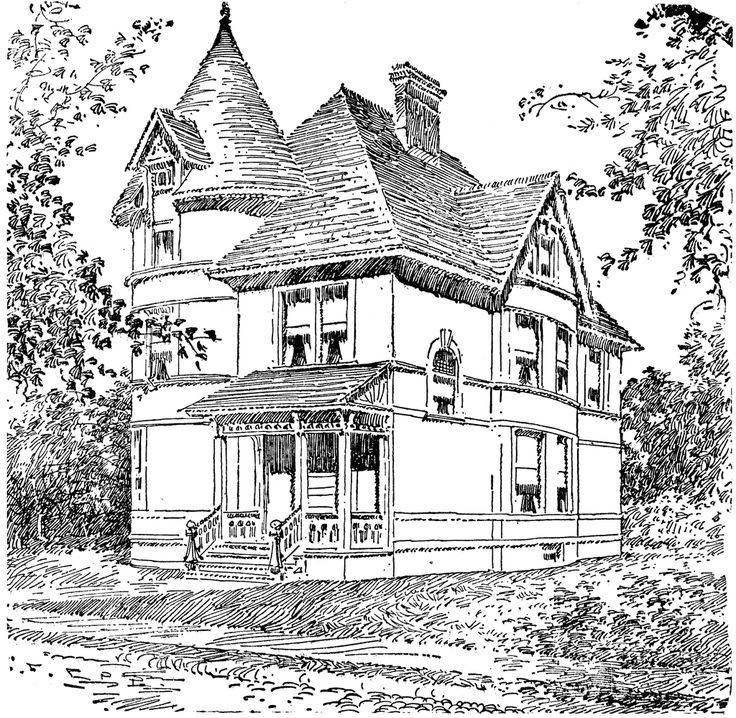
Locate an element on the screen. The image size is (736, 718). stairs is located at coordinates (233, 550).